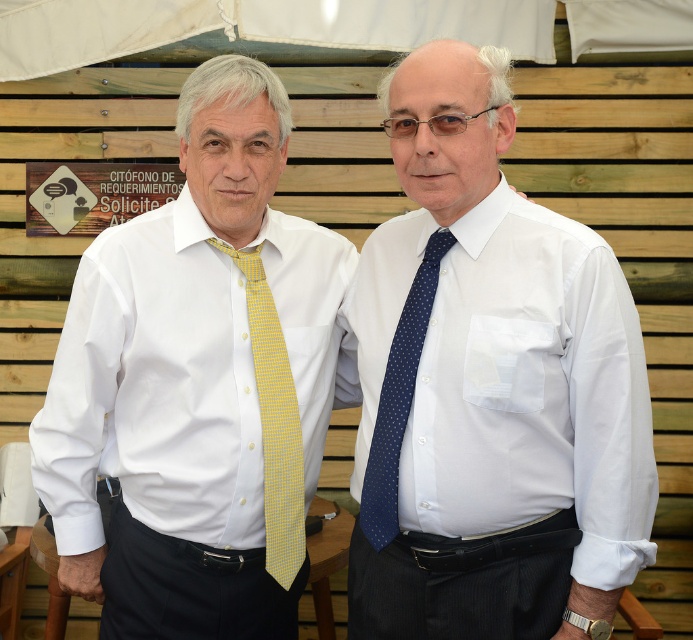
Question: In this image, where is white smooth shirt at center located relative to white smooth shirt at left?

Choices:
 (A) right
 (B) left

Answer: (A)

Question: Is white smooth shirt at left behind blue dotted tie at center?

Choices:
 (A) no
 (B) yes

Answer: (B)

Question: Among these points, which one is farthest from the camera?

Choices:
 (A) (398, 419)
 (B) (261, 381)
 (C) (444, 310)
 (D) (96, 253)

Answer: (B)

Question: Among these points, which one is farthest from the camera?

Choices:
 (A) (414, 364)
 (B) (263, 412)
 (C) (552, 488)

Answer: (B)

Question: Can you confirm if white smooth shirt at center is positioned to the left of yellow dotted tie at center?

Choices:
 (A) yes
 (B) no

Answer: (B)

Question: Which point is farther to the camera?

Choices:
 (A) yellow dotted tie at center
 (B) white smooth shirt at center

Answer: (A)